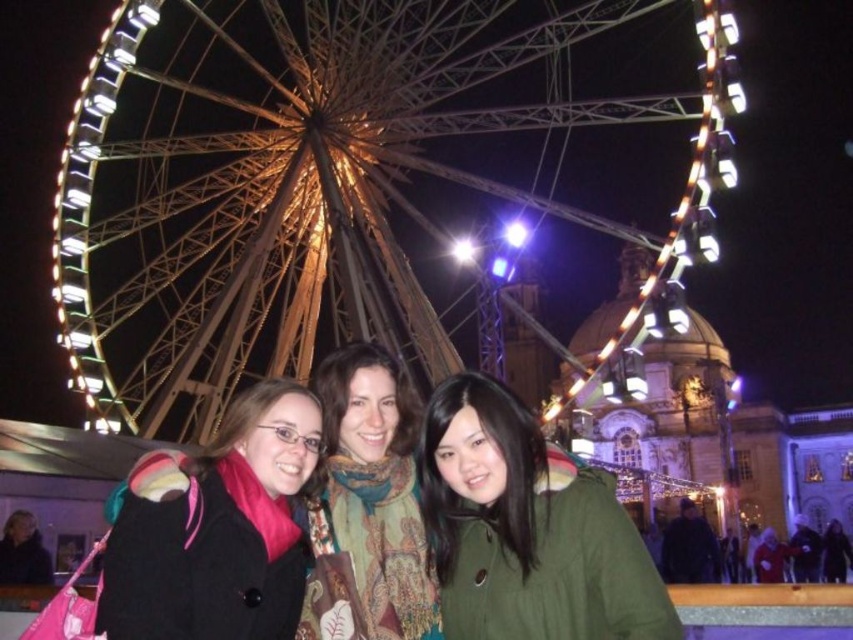
The image size is (853, 640). I want to click on green matte jacket at lower center, so click(527, 529).

At what (x,y) coordinates should I click in order to perform the action: click on green matte jacket at lower center. Please return your answer as a coordinate pair (x, y). Looking at the image, I should click on point(527,529).

Which is in front, point (167, 600) or point (381, 545)?

Point (167, 600)

Which of these two, matte black coat at center or green textured scarf at center, stands taller?

green textured scarf at center is taller.

Between point (218, 529) and point (357, 547), which one is positioned behind?

Point (357, 547)

This screenshot has width=853, height=640. I want to click on matte black coat at center, so click(219, 531).

The height and width of the screenshot is (640, 853). What do you see at coordinates (527, 529) in the screenshot?
I see `green matte jacket at lower center` at bounding box center [527, 529].

Who is more distant from viewer, [500,627] or [361,435]?

Point [361,435]

Where is `green matte jacket at lower center`? green matte jacket at lower center is located at coordinates (527, 529).